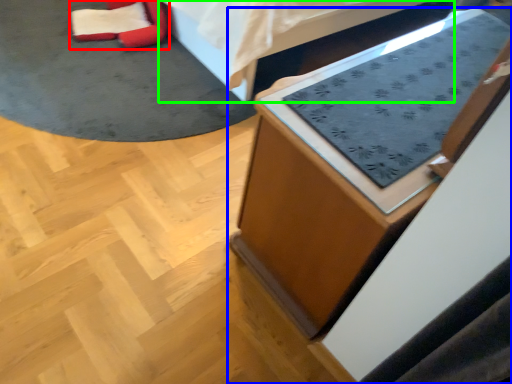
Question: Which is farther away from bean bag chair (highlighted by a red box)? furniture (highlighted by a blue box) or furniture (highlighted by a green box)?

Choices:
 (A) furniture
 (B) furniture

Answer: (A)